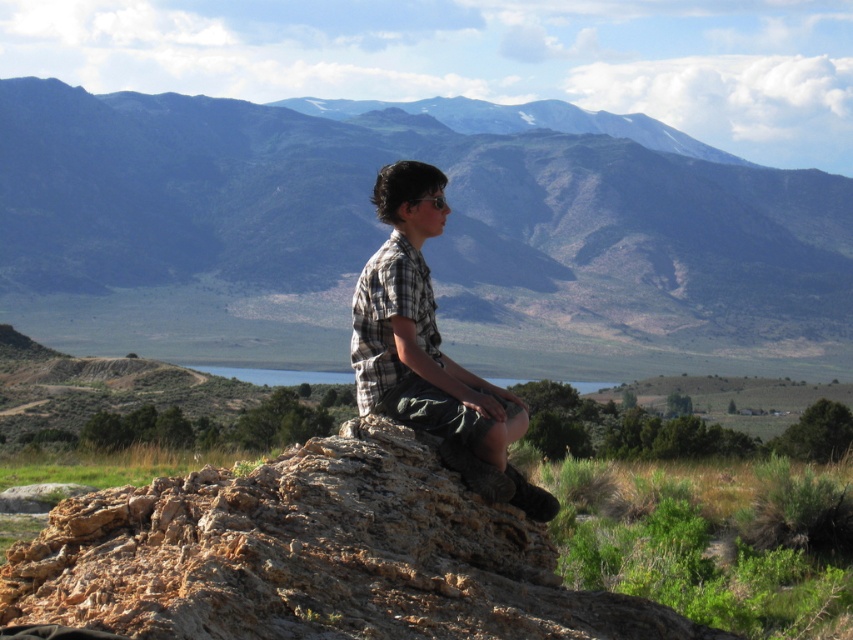
You are a photographer wanting to capture the plaid shirt at center in your shot. The camera is positioned at the point marked by coordinates point (428, 349). Is the plaid shirt at center within the camera frame?

The point marked by coordinates point (428, 349) marks the plaid shirt at center, so yes, the plaid shirt at center is exactly at the camera position and within the frame.

You are planning to take a photo of the plaid shirt at center and the blue glass lake at center. Which object should you focus on first if you want to capture both in the same frame without moving the camera?

The plaid shirt at center is thinner than the blue glass lake at center, so you should focus on the plaid shirt at center first to ensure it is sharp before the wider lake area.